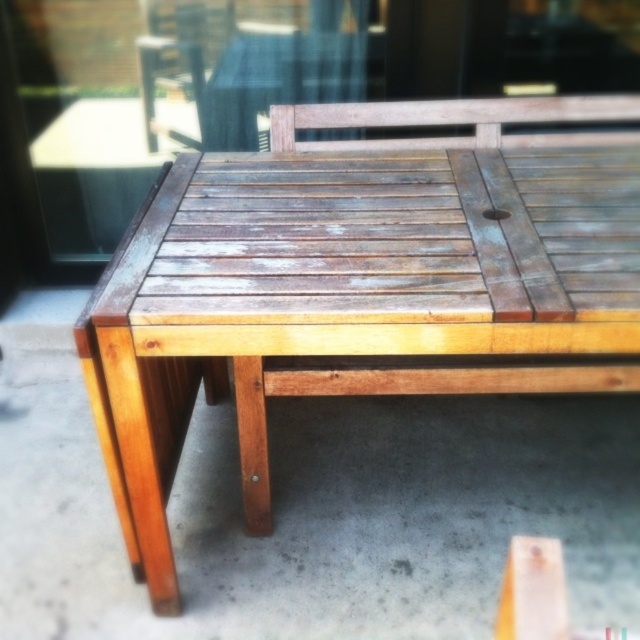
Which is in front, point (589, 99) or point (230, 17)?

Positioned in front is point (589, 99).

Is point (376, 236) positioned behind point (358, 74)?

No, it is not.

You are a GUI agent. You are given a task and a screenshot of the screen. Output one action in this format:
    pyautogui.click(x=<x>, y=<y>)
    Task: Click on the weathered wood picnic table at center
    
    Given the screenshot: What is the action you would take?
    pyautogui.click(x=356, y=284)